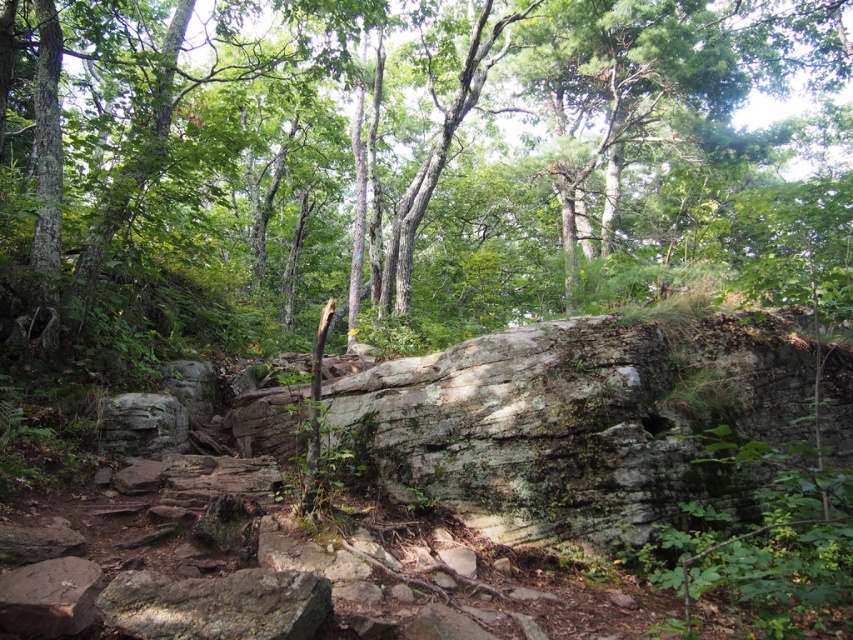
Question: Based on their relative distances, which object is farther from the gray/rough rock at center?

Choices:
 (A) green mossy rock at lower left
 (B) smooth gray rock at center

Answer: (B)

Question: Is gray/rough rock at center thinner than green mossy rock at lower left?

Choices:
 (A) yes
 (B) no

Answer: (B)

Question: Which object is the closest to the gray/rough rock at center?

Choices:
 (A) smooth gray rock at center
 (B) green mossy rock at lower left

Answer: (B)

Question: Which point is farther from the camera taking this photo?

Choices:
 (A) (44, 3)
 (B) (283, 632)

Answer: (A)

Question: Is smooth gray rock at center below green mossy rock at lower left?

Choices:
 (A) no
 (B) yes

Answer: (A)

Question: Is smooth gray rock at center above gray/rough rock at center?

Choices:
 (A) no
 (B) yes

Answer: (B)